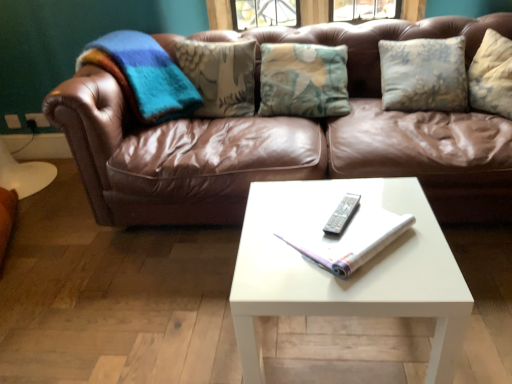
In order to click on free spot below white paper book at center (from a real-world perspective) in this screenshot , I will do `click(339, 229)`.